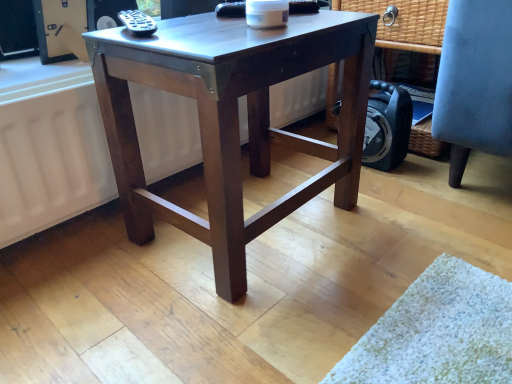
The image size is (512, 384). Identify the location of free spot in front of dark wood table at center. (253, 319).